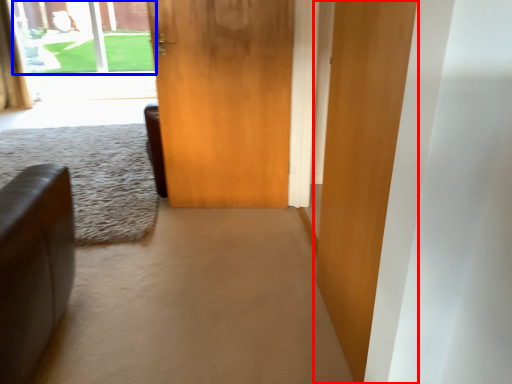
Question: Which point is closer to the camera, door (highlighted by a red box) or window screen (highlighted by a blue box)?

Choices:
 (A) door
 (B) window screen

Answer: (A)